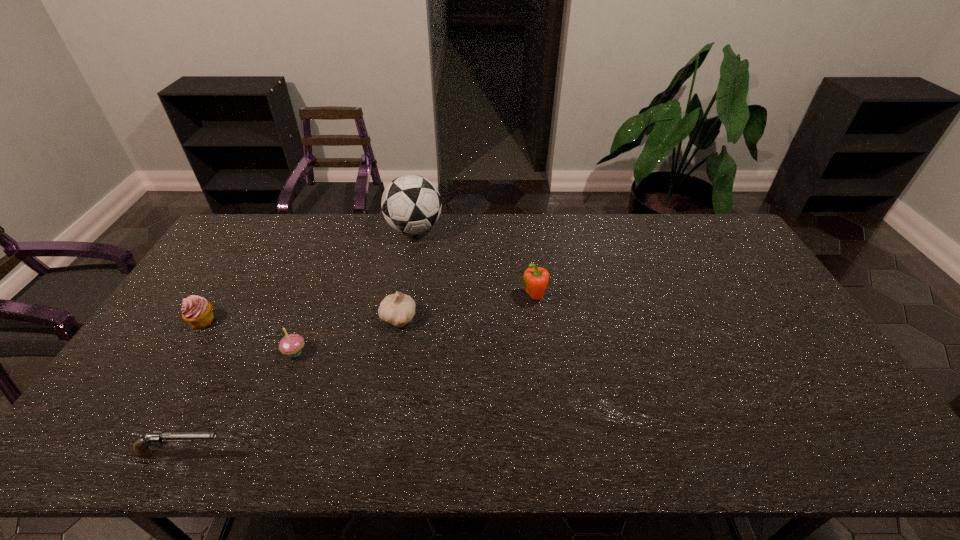
What are the coordinates of `soccer ball` in the screenshot? It's located at (411, 204).

Locate an element on the screen. Image resolution: width=960 pixels, height=540 pixels. the farthest object is located at coordinates (411, 204).

This screenshot has width=960, height=540. I want to click on pepper, so pyautogui.click(x=535, y=278).

The height and width of the screenshot is (540, 960). I want to click on the rightmost object, so click(x=535, y=278).

This screenshot has height=540, width=960. I want to click on garlic, so click(398, 309).

At what (x,y) coordinates should I click in order to perform the action: click on the left cupcake. Please return your answer as a coordinate pair (x, y). Looking at the image, I should click on (196, 311).

Image resolution: width=960 pixels, height=540 pixels. Identify the location of the farther cupcake. (196, 311).

At what (x,y) coordinates should I click in order to perform the action: click on the right cupcake. Please return your answer as a coordinate pair (x, y). Looking at the image, I should click on (292, 344).

Image resolution: width=960 pixels, height=540 pixels. Identify the location of the fourth object from right to left. (292, 344).

Locate an element on the screen. the nearest object is located at coordinates (141, 447).